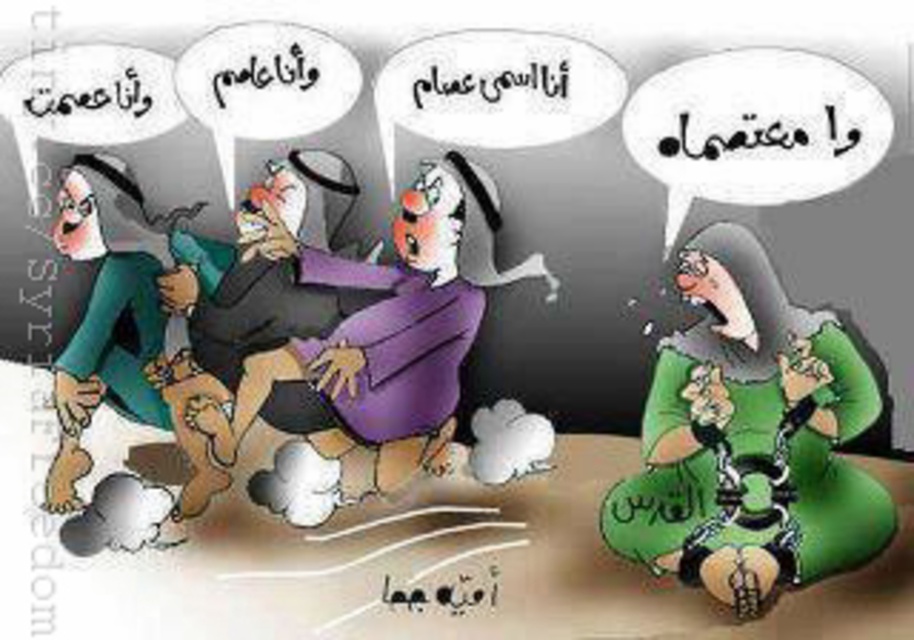
Question: Among these points, which one is farthest from the camera?

Choices:
 (A) (96, 337)
 (B) (274, 404)

Answer: (B)

Question: Which of the following is the closest to the observer?

Choices:
 (A) (378, 468)
 (B) (737, 506)
 (C) (178, 332)

Answer: (C)

Question: Does green matte dress at lower right have a smaller size compared to matte green dress at left?

Choices:
 (A) no
 (B) yes

Answer: (A)

Question: Is green matte dress at lower right below matte green dress at left?

Choices:
 (A) yes
 (B) no

Answer: (A)

Question: Which of the following is the closest to the observer?

Choices:
 (A) green matte dress at lower right
 (B) purple matte dress at center

Answer: (A)

Question: Is green matte dress at lower right above matte green dress at left?

Choices:
 (A) no
 (B) yes

Answer: (A)